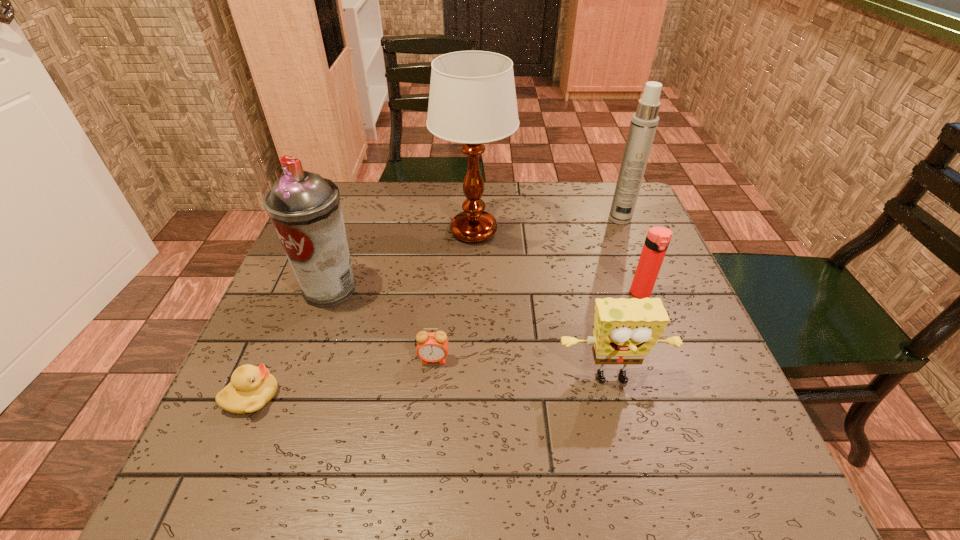
Find the location of a particular element. vacant space in between the table lamp and the thermos bottle is located at coordinates (558, 262).

Locate an element on the screen. The width and height of the screenshot is (960, 540). free spot between the right aerosol can and the thermos bottle is located at coordinates (631, 256).

Where is `free spot between the table lamp and the left aerosol can`? free spot between the table lamp and the left aerosol can is located at coordinates (402, 260).

This screenshot has width=960, height=540. What are the coordinates of `vacant point located between the table lamp and the nearer aerosol can` in the screenshot? It's located at (402, 260).

The image size is (960, 540). I want to click on vacant area between the table lamp and the duckling, so click(363, 314).

You are a GUI agent. You are given a task and a screenshot of the screen. Output one action in this format:
    pyautogui.click(x=<x>, y=<y>)
    Task: Click on the free space that is in between the alarm clock and the farther aerosol can
    Image resolution: width=960 pixels, height=540 pixels.
    Given the screenshot: What is the action you would take?
    pyautogui.click(x=527, y=289)

Where is `object that is the third closest one to the table lamp`? object that is the third closest one to the table lamp is located at coordinates (657, 240).

The image size is (960, 540). I want to click on the closest object relative to the right aerosol can, so click(x=657, y=240).

This screenshot has height=540, width=960. What are the coordinates of `free space that satisfies the following two spatial constraints: 1. on the front-facing side of the sponge; 2. on the front-facing side of the shortest object` in the screenshot? It's located at (616, 396).

Where is `free spot that satisfies the following two spatial constraints: 1. on the back side of the nearer aerosol can; 2. on the left side of the table lamp`? This screenshot has width=960, height=540. free spot that satisfies the following two spatial constraints: 1. on the back side of the nearer aerosol can; 2. on the left side of the table lamp is located at coordinates (350, 231).